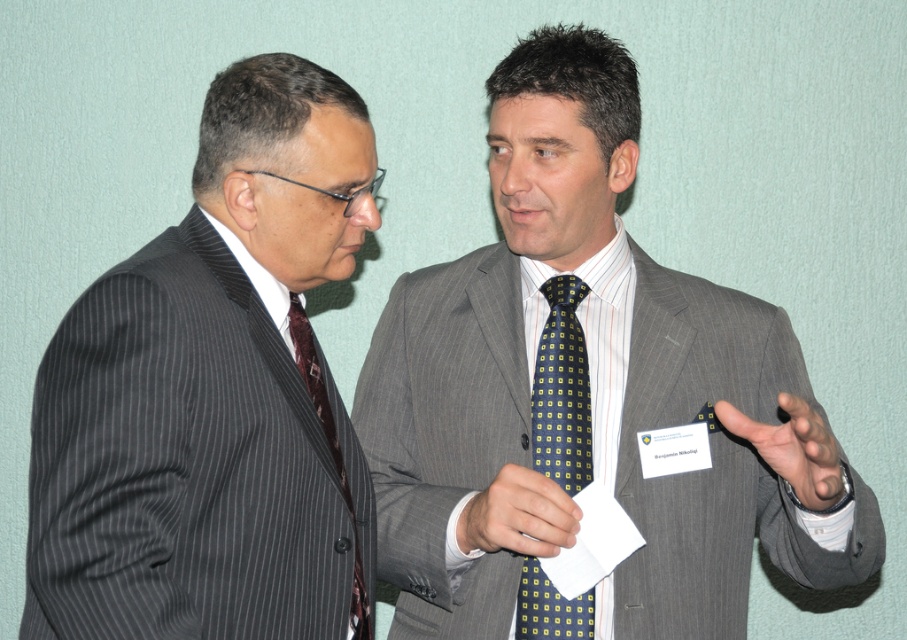
Can you confirm if yellow-green dotted tie at center is shorter than maroon silk tie at left?

Incorrect, yellow-green dotted tie at center's height does not fall short of maroon silk tie at left's.

Describe the element at coordinates (561, 388) in the screenshot. I see `yellow-green dotted tie at center` at that location.

Find the location of `yellow-green dotted tie at center`. yellow-green dotted tie at center is located at coordinates (561, 388).

Which is above, yellow dotted tie at center or matte yellow tie at right?

matte yellow tie at right

Does point (504, 509) come in front of point (805, 490)?

That is False.

Where is `yellow dotted tie at center`? yellow dotted tie at center is located at coordinates (518, 515).

Does matte black suit at left have a lesser width compared to yellow-green dotted tie at center?

Incorrect, matte black suit at left's width is not less than yellow-green dotted tie at center's.

Is point (36, 600) less distant than point (544, 422)?

Yes, point (36, 600) is closer to viewer.

Where is `matte black suit at left`? The image size is (907, 640). matte black suit at left is located at coordinates (213, 394).